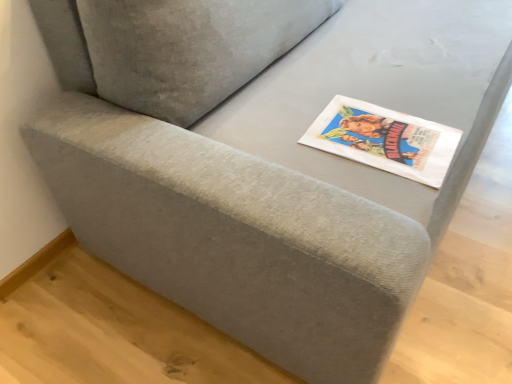
What are the coordinates of `empty space that is ontop of matte paper poster at center (from a real-world perspective)` in the screenshot? It's located at (376, 135).